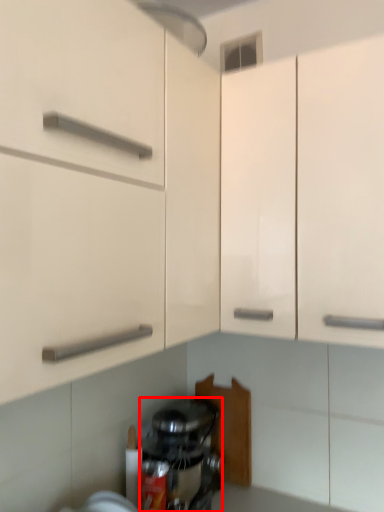
Question: From the image's perspective, where is home appliance (annotated by the red box) located in relation to cabinetry in the image?

Choices:
 (A) above
 (B) below

Answer: (B)